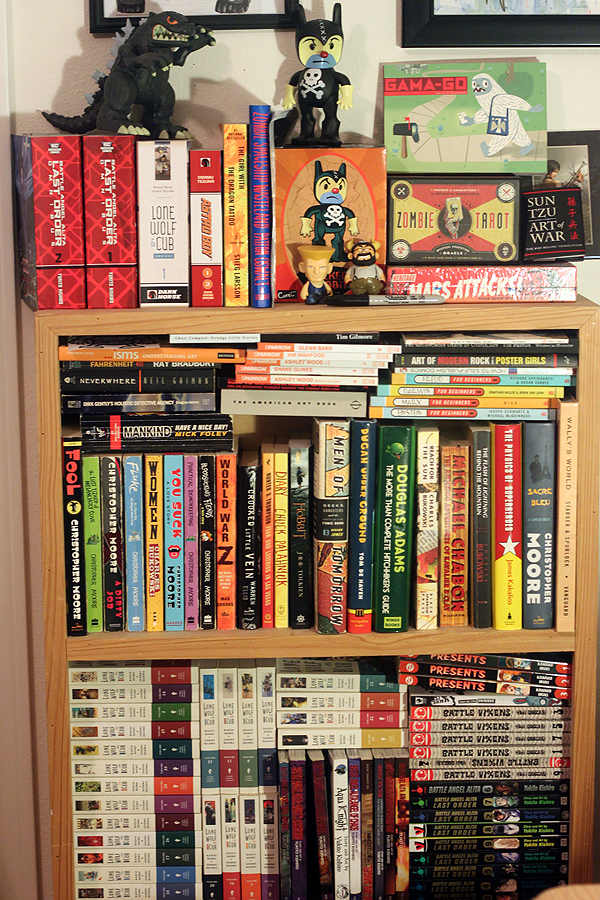
Find the location of `wood edges of book shelf`. wood edges of book shelf is located at coordinates (309, 324), (42, 489), (586, 511), (315, 649), (57, 794), (583, 786).